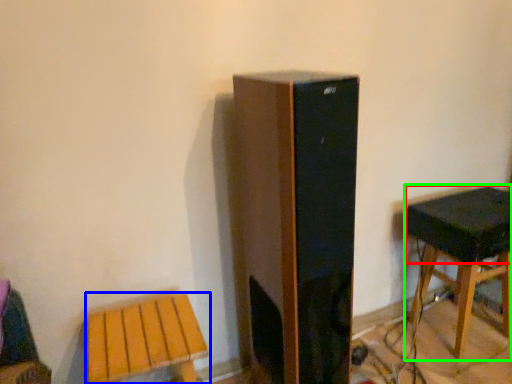
Question: Based on their relative distances, which object is nearer to speaker (highlighted by a red box)? Choose from stool (highlighted by a blue box) and stool (highlighted by a green box).

Choices:
 (A) stool
 (B) stool

Answer: (B)